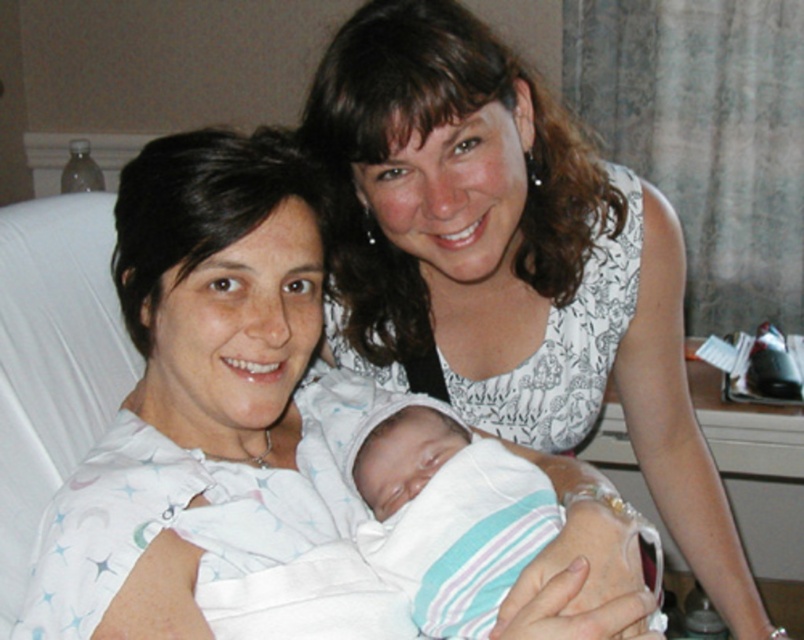
Can you confirm if white fabric baby at center is wider than white striped fabric at center?

A: Correct, the width of white fabric baby at center exceeds that of white striped fabric at center.

What do you see at coordinates (204, 381) in the screenshot?
I see `white fabric baby at center` at bounding box center [204, 381].

Is point (226, 250) farther from camera compared to point (478, 493)?

No, (226, 250) is in front of (478, 493).

Where is `white fabric baby at center`? This screenshot has width=804, height=640. white fabric baby at center is located at coordinates (204, 381).